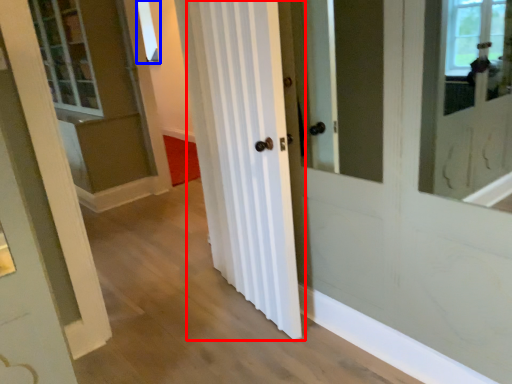
Question: Among these objects, which one is nearest to the camera, curtain (highlighted by a red box) or window (highlighted by a blue box)?

Choices:
 (A) curtain
 (B) window

Answer: (A)